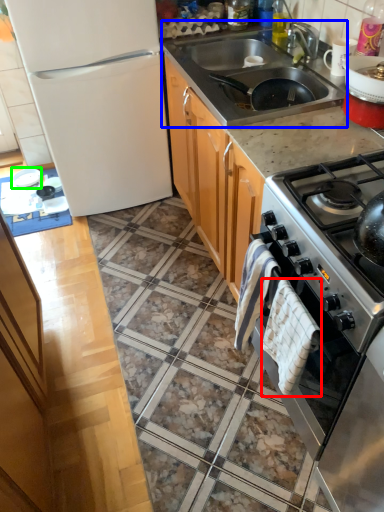
Question: Which object is the closest to the blanket (highlighted by a red box)? Choose among these: sink (highlighted by a blue box) or appliance (highlighted by a green box).

Choices:
 (A) sink
 (B) appliance

Answer: (A)